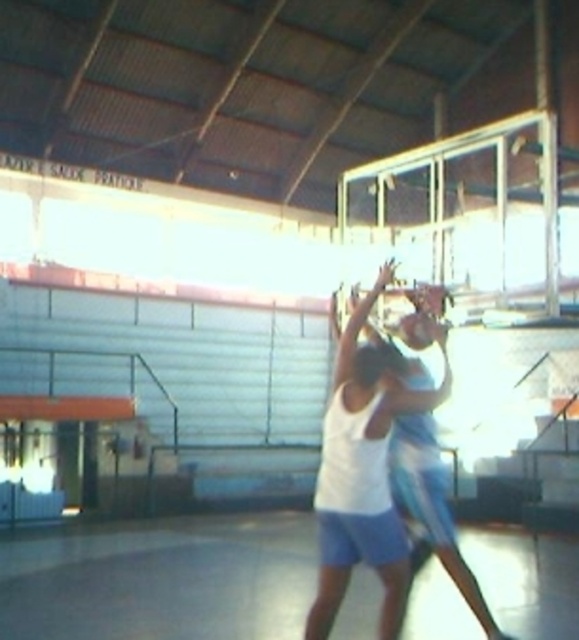
You are standing at the entrance of the basketball court and want to find the smooth concrete floor at center. According to the coordinates provided, in which direction should you move from your current position?

The smooth concrete floor at center is located at coordinates point (160,577). Since the coordinate system typically has (0,0) at the bottom left corner, you should move towards the right and upwards from the entrance to reach it.

You are a basketball coach planning to place a 20 cm wide equipment box on the smooth concrete floor at center. The white matte basketball at center has a diameter of 24 cm. Will the equipment box fit on the floor without overlapping the basketball?

The smooth concrete floor at center is wider than the white matte basketball at center, so the equipment box with 20 cm width can be placed on the floor without overlapping the basketball as there is enough space between them.

You are a basketball coach observing the court. You notice the smooth concrete floor at center and the white matte basketball at center. Which object takes up more space in the image?

The smooth concrete floor at center has a larger size compared to the white matte basketball at center, so it takes up more space in the image.